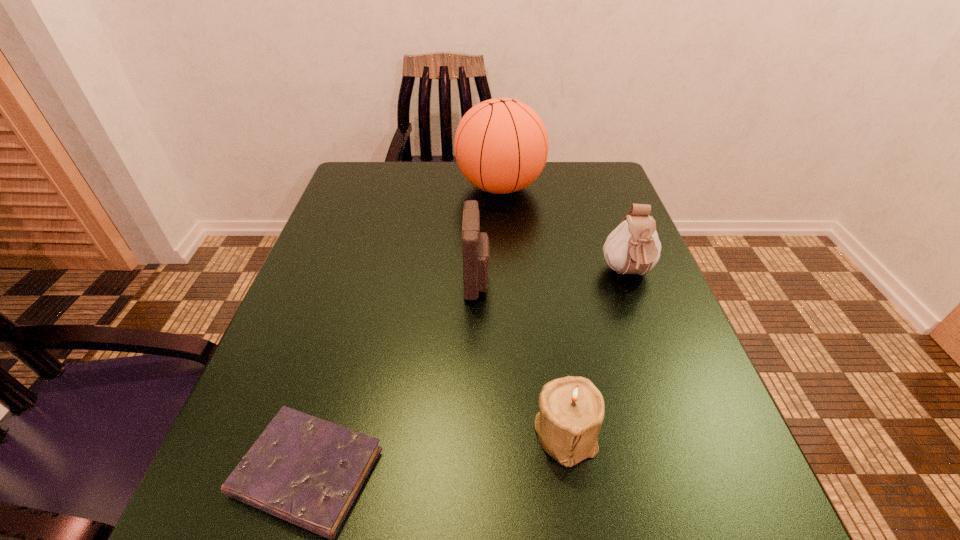
Identify the location of basketball. The image size is (960, 540). [x=501, y=145].

Locate an element on the screen. The image size is (960, 540). the farthest object is located at coordinates (501, 145).

In order to click on the left pouch in this screenshot , I will do `click(475, 245)`.

Identify the location of the right pouch. The image size is (960, 540). (633, 247).

Where is `candle_holder`? candle_holder is located at coordinates (572, 409).

In order to click on vacant space located on the front of the tallest object in this screenshot , I will do `click(507, 299)`.

Where is `free space located 0.260m with an open flap on the left pouch`? free space located 0.260m with an open flap on the left pouch is located at coordinates (620, 280).

Locate an element on the screen. This screenshot has width=960, height=540. free point located 0.110m on the front-facing side of the right pouch is located at coordinates (653, 341).

The height and width of the screenshot is (540, 960). Identify the location of vacant space located 0.400m on the left of the candle_holder. (257, 433).

This screenshot has height=540, width=960. In order to click on object present at the far edge in this screenshot , I will do `click(501, 145)`.